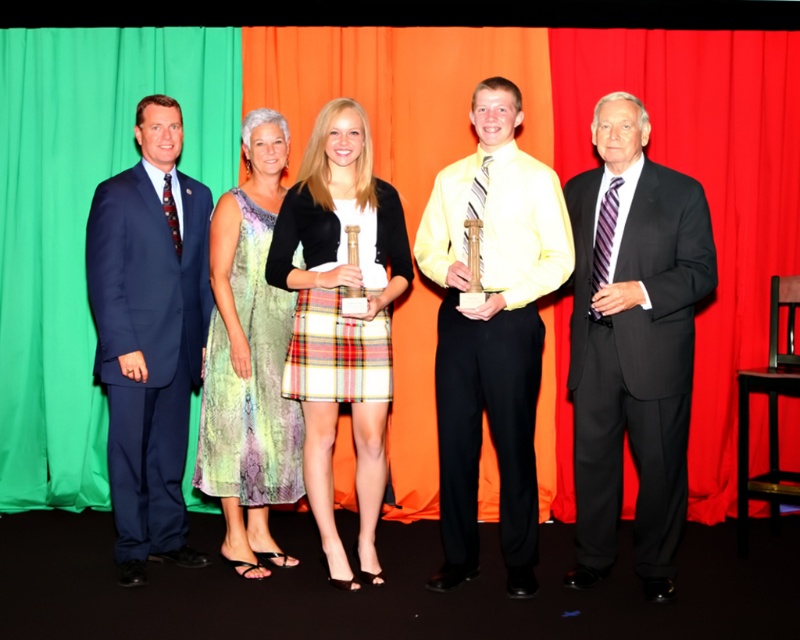
Is dark gray suit at center above matte blue suit at left?

No, dark gray suit at center is not above matte blue suit at left.

Is dark gray suit at center wider than matte blue suit at left?

Indeed, dark gray suit at center has a greater width compared to matte blue suit at left.

Locate an element on the screen. The width and height of the screenshot is (800, 640). dark gray suit at center is located at coordinates (633, 342).

Does yellow striped tie at center lie in front of plaid skirt at center?

That is True.

Can you confirm if yellow striped tie at center is wider than plaid skirt at center?

Indeed, yellow striped tie at center has a greater width compared to plaid skirt at center.

The image size is (800, 640). I want to click on yellow striped tie at center, so click(x=492, y=330).

Does dark gray suit at center lie in front of multicolored printed dress at center?

Yes, it is in front of multicolored printed dress at center.

Based on the photo, is dark gray suit at center thinner than multicolored printed dress at center?

No.

Is point (634, 435) positioned after point (260, 307)?

No, (634, 435) is in front of (260, 307).

This screenshot has width=800, height=640. I want to click on dark gray suit at center, so click(x=633, y=342).